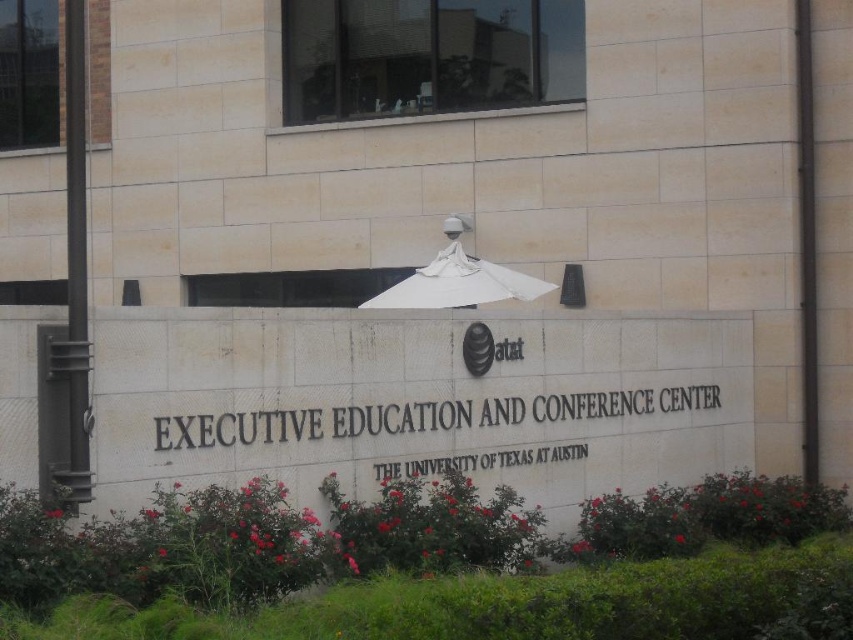
Question: Where is white stone sign at center located in relation to white matte umbrella at center in the image?

Choices:
 (A) above
 (B) below

Answer: (B)

Question: Does white stone sign at center lie in front of white matte umbrella at center?

Choices:
 (A) yes
 (B) no

Answer: (A)

Question: Does white stone sign at center lie behind white matte umbrella at center?

Choices:
 (A) yes
 (B) no

Answer: (B)

Question: Among these points, which one is nearest to the camera?

Choices:
 (A) (444, 284)
 (B) (381, 474)

Answer: (B)

Question: Which point is closer to the camera?

Choices:
 (A) white stone sign at center
 (B) white matte umbrella at center

Answer: (A)